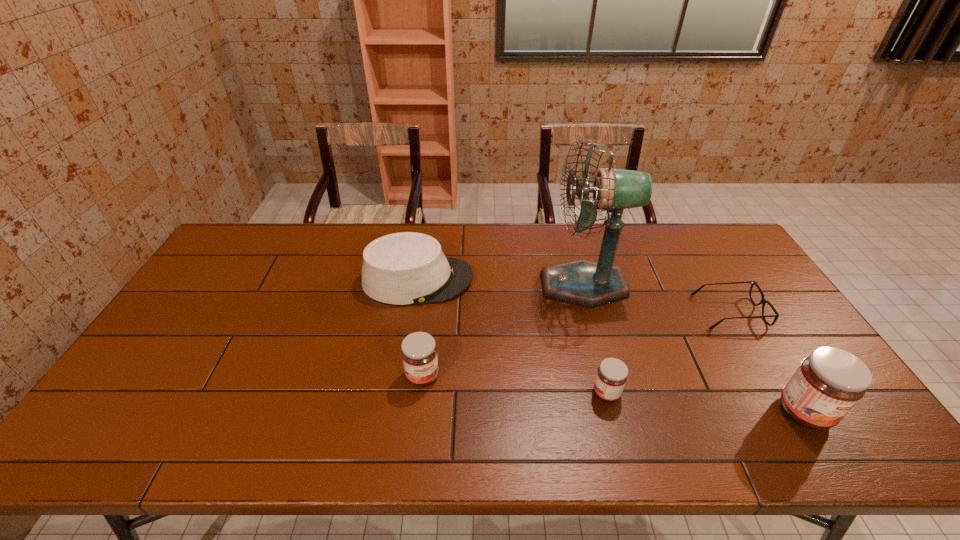
Identify the location of jam that is at the right edge. (830, 382).

You are a GUI agent. You are given a task and a screenshot of the screen. Output one action in this format:
    pyautogui.click(x=<x>, y=<y>)
    Task: Click on the spectacles situated at the right edge
    The image size is (960, 540).
    Given the screenshot: What is the action you would take?
    pyautogui.click(x=763, y=301)

You are a GUI agent. You are given a task and a screenshot of the screen. Output one action in this format:
    pyautogui.click(x=<x>, y=<y>)
    Task: Click on the object situated at the near right corner
    This screenshot has height=540, width=960.
    Given the screenshot: What is the action you would take?
    pyautogui.click(x=830, y=382)

Image resolution: width=960 pixels, height=540 pixels. In order to click on free point at the far edge in this screenshot , I will do `click(682, 242)`.

Identify the location of vacant space at the near edge of the desktop. click(431, 400).

The height and width of the screenshot is (540, 960). In the image, there is a desktop. Identify the location of free region at the left edge. (238, 280).

The width and height of the screenshot is (960, 540). In the image, there is a desktop. Identify the location of vacant space at the far left corner. (276, 233).

In the image, there is a desktop. Where is `blank space at the near left corner`? The image size is (960, 540). blank space at the near left corner is located at coordinates (109, 408).

Where is `free spot between the tallest object and the leftmost jam`? This screenshot has height=540, width=960. free spot between the tallest object and the leftmost jam is located at coordinates (503, 330).

You are a GUI agent. You are given a task and a screenshot of the screen. Output one action in this format:
    pyautogui.click(x=<x>, y=<y>)
    Task: Click on the free point between the tallest object and the fifth tallest object
    
    Given the screenshot: What is the action you would take?
    pyautogui.click(x=595, y=339)